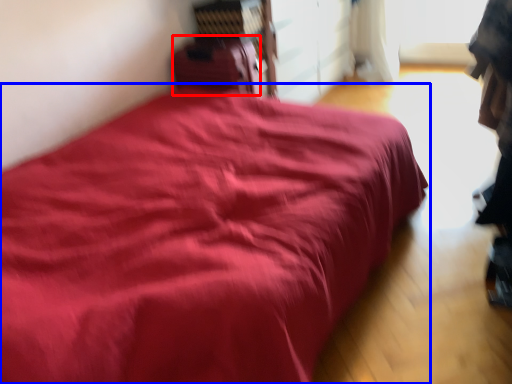
Question: Which of the following is the closest to the observer, luggage (highlighted by a red box) or bed (highlighted by a blue box)?

Choices:
 (A) luggage
 (B) bed

Answer: (B)